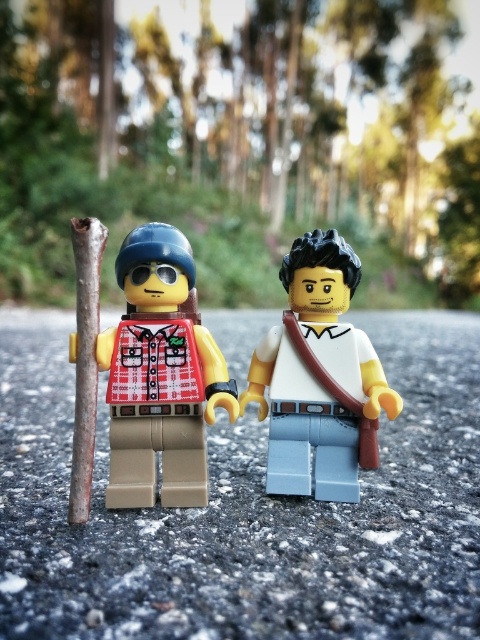
You are a photographer standing in the forest scene. You want to take a picture of the matte yellow figure at left. Where should you position your camera to capture the figure in the frame?

The matte yellow figure at left is located at point 2D coordinates (159,374), so you should position your camera to aim at that coordinate to capture the figure in the frame.

Consider the image. You are a photographer setting up a shot of the matte yellow figure at left and the white matte shirt at center. The camera is positioned to the right of the scene. Which figure should you adjust to ensure both are in frame?

The matte yellow figure at left is to the left of the white matte shirt at center. To ensure both are in frame, adjust the matte yellow figure at left to move it further to the right so it aligns better with the camera position.